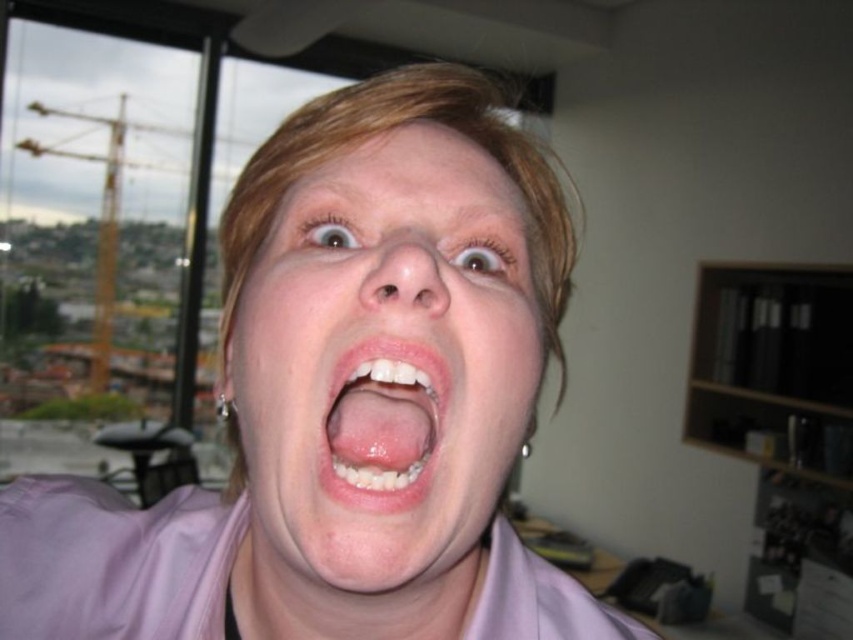
You are a photographer adjusting your camera settings. You notice the pink satin shirt at center and the pink glossy lips at center in your frame. Which object should you focus on to ensure the closest object is sharp?

The pink satin shirt at center is closer to the viewer than the pink glossy lips at center, so you should focus on the pink satin shirt at center to ensure the closest object is sharp.

You are a photographer adjusting the camera focus. The subject is wearing a pink satin shirt at center and has pink glossy lips at center. Which object should you focus on first if you want to capture both details clearly, considering their sizes?

The pink satin shirt at center has a larger width than the pink glossy lips at center, so focusing on the larger pink satin shirt at center first would ensure both details are captured clearly.

You are a photographer adjusting the focus on your camera. The subject has a smooth skin face at center and pink glossy lips at center. If your camera can only focus on one of these features, which one should you choose to ensure the lips are in sharp focus?

To ensure the pink glossy lips at center are in sharp focus, you should focus on the smooth skin face at center because they are 1.58 inches apart, meaning focusing on the face will also bring the lips into focus due to their close proximity.